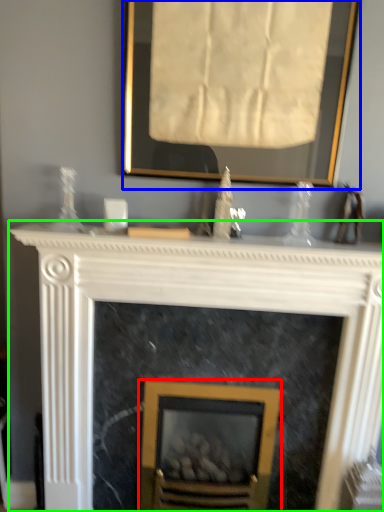
Question: Which object is positioned closest to fireplace (highlighted by a red box)? Select from picture frame (highlighted by a blue box) and fireplace (highlighted by a green box).

Choices:
 (A) picture frame
 (B) fireplace

Answer: (B)